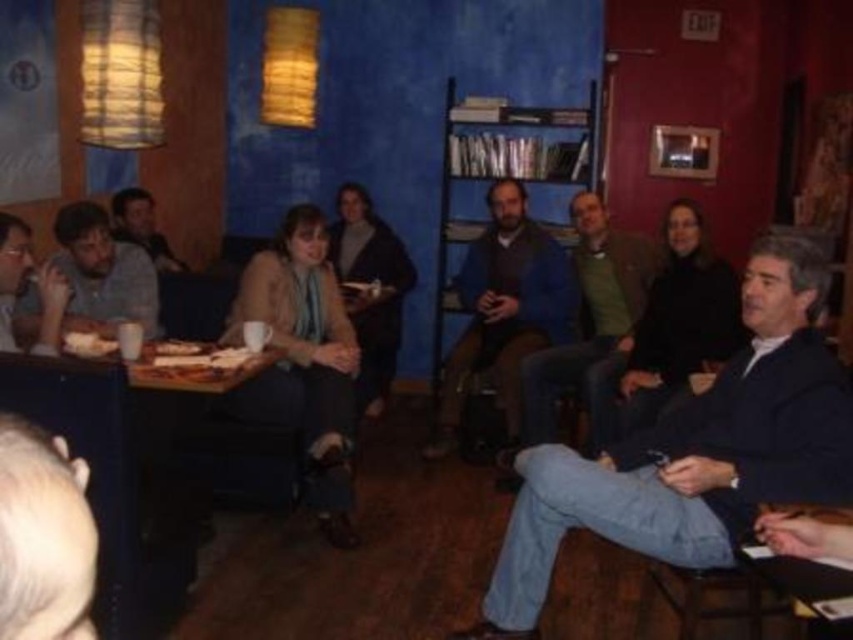
You are a barista in this cozy indoor setting and need to place the matte brown bread at lower left on the table where the dark blue jacket at center is currently located. Is there enough space for the bread?

The dark blue jacket at center is larger in size than the matte brown bread at lower left. Since the jacket is already occupying the space, there might not be enough room for the bread unless the jacket is moved.

Please provide the coordinates of the dark blue jacket at center in the image. The coordinates should be in the format of a point with two decimal places, such as point (503, 310). The scene is a cozy indoor setting with a group of people around a table, and the jacket is part of someone wearing it.

The dark blue jacket at center is located at point (503, 310).